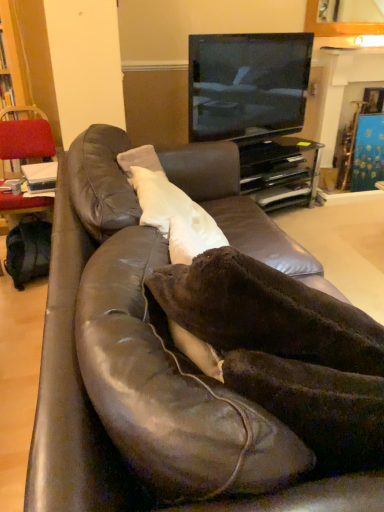
What do you see at coordinates (344, 90) in the screenshot? The width and height of the screenshot is (384, 512). I see `metallic gold fireplace at upper center` at bounding box center [344, 90].

Image resolution: width=384 pixels, height=512 pixels. I want to click on white soft pillow at center, so click(x=175, y=216).

What do you see at coordinates (26, 135) in the screenshot? I see `velvet red chair at left` at bounding box center [26, 135].

Describe the element at coordinates (130, 368) in the screenshot. I see `brown leather couch at center` at that location.

The image size is (384, 512). What do you see at coordinates (279, 170) in the screenshot? I see `black glossy entertainment center at upper center` at bounding box center [279, 170].

What is the approximate width of black glossy entertainment center at upper center?

It is 17.88 inches.

Locate an element on the screen. The height and width of the screenshot is (512, 384). metallic gold fireplace at upper center is located at coordinates (344, 90).

Is velvet red chair at left not close to black glossy tv at upper center?

Yes, velvet red chair at left is far from black glossy tv at upper center.

In the scene shown: In the image, is velvet red chair at left on the left side or the right side of black glossy tv at upper center?

velvet red chair at left is positioned on black glossy tv at upper center's left side.

From the image's perspective, which object appears higher, velvet red chair at left or black glossy tv at upper center?

From the image's view, black glossy tv at upper center is above.

Which of these two, velvet red chair at left or black glossy tv at upper center, is smaller?

Smaller between the two is black glossy tv at upper center.

Is velvet red chair at left shorter than black glossy entertainment center at upper center?

In fact, velvet red chair at left may be taller than black glossy entertainment center at upper center.

Looking at the image, does velvet red chair at left seem bigger or smaller compared to black glossy entertainment center at upper center?

Clearly, velvet red chair at left is larger in size than black glossy entertainment center at upper center.

From the image's perspective, which object appears higher, velvet red chair at left or black glossy entertainment center at upper center?

black glossy entertainment center at upper center is shown above in the image.

Looking at this image, could you tell me if velvet red chair at left is facing black glossy entertainment center at upper center?

No, velvet red chair at left is not turned towards black glossy entertainment center at upper center.

Is metallic gold fireplace at upper center surrounding brown leather couch at center?

No, brown leather couch at center is not a part of metallic gold fireplace at upper center.

Which of these two, metallic gold fireplace at upper center or brown leather couch at center, is bigger?

With larger size is brown leather couch at center.

Is metallic gold fireplace at upper center aimed at brown leather couch at center?

No.

Is white soft pillow at center shorter than black glossy tv at upper center?

Indeed, white soft pillow at center has a lesser height compared to black glossy tv at upper center.

Find the location of a particular element. This screenshot has height=512, width=384. television behind the white soft pillow at center is located at coordinates (247, 84).

Which is in front, point (216, 245) or point (257, 94)?

The point (216, 245) is closer.

Is brown leather couch at center positioned far away from velvet red chair at left?

Indeed, brown leather couch at center is not near velvet red chair at left.

Is brown leather couch at center taller or shorter than velvet red chair at left?

In the image, brown leather couch at center appears to be taller than velvet red chair at left.

Choose the correct answer: Is brown leather couch at center inside velvet red chair at left or outside it?

brown leather couch at center exists outside the volume of velvet red chair at left.

From the picture: How far apart are brown leather couch at center and velvet red chair at left?

A distance of 1.39 meters exists between brown leather couch at center and velvet red chair at left.

The width and height of the screenshot is (384, 512). Find the location of `pillow located below the black glossy entertainment center at upper center (from the image's perspective)`. pillow located below the black glossy entertainment center at upper center (from the image's perspective) is located at coordinates (175, 216).

How far apart are white soft pillow at center and black glossy entertainment center at upper center?

They are 5.02 feet apart.

From a real-world perspective, is white soft pillow at center physically below black glossy entertainment center at upper center?

Incorrect, from a real-world perspective, white soft pillow at center is higher than black glossy entertainment center at upper center.

Is white soft pillow at center surrounding black glossy entertainment center at upper center?

No, black glossy entertainment center at upper center is not a part of white soft pillow at center.

From the image's perspective, which is above, white soft pillow at center or metallic gold fireplace at upper center?

metallic gold fireplace at upper center.

Is white soft pillow at center aimed at metallic gold fireplace at upper center?

No, white soft pillow at center is not facing towards metallic gold fireplace at upper center.

You are a GUI agent. You are given a task and a screenshot of the screen. Output one action in this format:
    pyautogui.click(x=<x>, y=<y>)
    Task: Click on the fireplace to the right of white soft pillow at center
    
    Given the screenshot: What is the action you would take?
    pyautogui.click(x=344, y=90)

Image resolution: width=384 pixels, height=512 pixels. In order to click on television above the velvet red chair at left (from a real-world perspective) in this screenshot , I will do `click(247, 84)`.

Where is `chair located in front of the black glossy entertainment center at upper center`? The width and height of the screenshot is (384, 512). chair located in front of the black glossy entertainment center at upper center is located at coordinates (26, 135).

Considering their positions, is brown leather couch at center positioned closer to metallic gold fireplace at upper center than black glossy entertainment center at upper center?

Among the two, black glossy entertainment center at upper center is located nearer to metallic gold fireplace at upper center.

Considering their positions, is brown leather couch at center positioned further to black glossy tv at upper center than white soft pillow at center?

Based on the image, brown leather couch at center appears to be further to black glossy tv at upper center.

Consider the image. Estimate the real-world distances between objects in this image. Which object is closer to metallic gold fireplace at upper center, velvet red chair at left or black glossy entertainment center at upper center?

black glossy entertainment center at upper center lies closer to metallic gold fireplace at upper center than the other object.

Looking at the image, which one is located closer to metallic gold fireplace at upper center, black glossy tv at upper center or black glossy entertainment center at upper center?

black glossy entertainment center at upper center lies closer to metallic gold fireplace at upper center than the other object.

Considering their positions, is velvet red chair at left positioned closer to black glossy tv at upper center than white soft pillow at center?

Among the two, white soft pillow at center is located nearer to black glossy tv at upper center.

Based on their spatial positions, is metallic gold fireplace at upper center or brown leather couch at center closer to velvet red chair at left?

brown leather couch at center.

Considering their positions, is velvet red chair at left positioned closer to black glossy tv at upper center than brown leather couch at center?

The object closer to black glossy tv at upper center is velvet red chair at left.

From the image, which object appears to be nearer to velvet red chair at left, brown leather couch at center or black glossy entertainment center at upper center?

brown leather couch at center lies closer to velvet red chair at left than the other object.

The image size is (384, 512). Find the location of `pillow between brown leather couch at center and black glossy tv at upper center in the front-back direction`. pillow between brown leather couch at center and black glossy tv at upper center in the front-back direction is located at coordinates click(175, 216).

Locate an element on the screen. pillow between velvet red chair at left and black glossy entertainment center at upper center from left to right is located at coordinates click(x=175, y=216).

What are the coordinates of `entertainment center between black glossy tv at upper center and metallic gold fireplace at upper center` in the screenshot? It's located at (279, 170).

At what (x,y) coordinates should I click in order to perform the action: click on entertainment center between white soft pillow at center and metallic gold fireplace at upper center in the front-back direction. Please return your answer as a coordinate pair (x, y). This screenshot has width=384, height=512. Looking at the image, I should click on (279, 170).